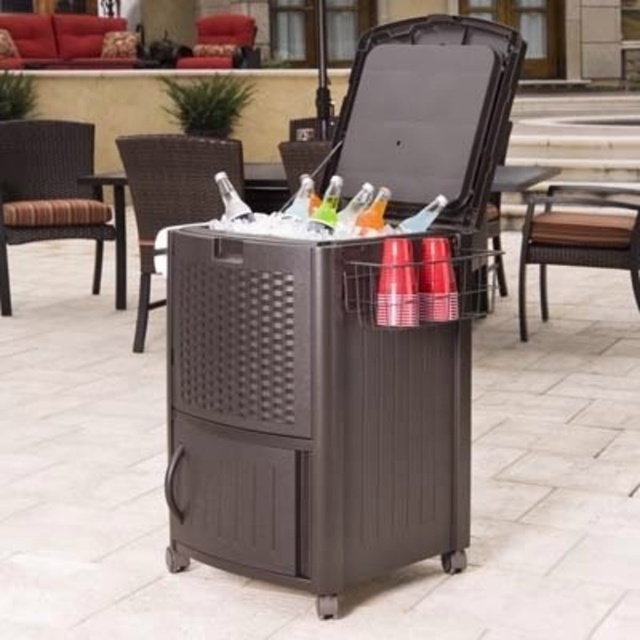
Looking at this image, does brown plastic cooler at center appear under matte plastic chair at upper center?

Yes.

Does brown plastic cooler at center have a lesser width compared to matte plastic chair at upper center?

Incorrect, brown plastic cooler at center's width is not less than matte plastic chair at upper center's.

Does point (177, 221) lie behind point (294, 180)?

That is True.

Identify the location of brown plastic cooler at center. (x=115, y=227).

The height and width of the screenshot is (640, 640). Describe the element at coordinates (172, 193) in the screenshot. I see `brown wicker chair at upper left` at that location.

Is the position of brown wicker chair at upper left more distant than that of brown plastic cooler at center?

That is False.

The image size is (640, 640). Describe the element at coordinates (172, 193) in the screenshot. I see `brown wicker chair at upper left` at that location.

In order to click on brown wicker chair at upper left in this screenshot , I will do `click(172, 193)`.

Does brown wicker chair at left have a smaller size compared to brown wicker chair at upper left?

No, brown wicker chair at left is not smaller than brown wicker chair at upper left.

Is brown wicker chair at left taller than brown wicker chair at upper left?

Indeed, brown wicker chair at left has a greater height compared to brown wicker chair at upper left.

Between point (84, 209) and point (179, 145), which one is positioned in front?

Positioned in front is point (179, 145).

I want to click on brown wicker chair at left, so click(x=49, y=189).